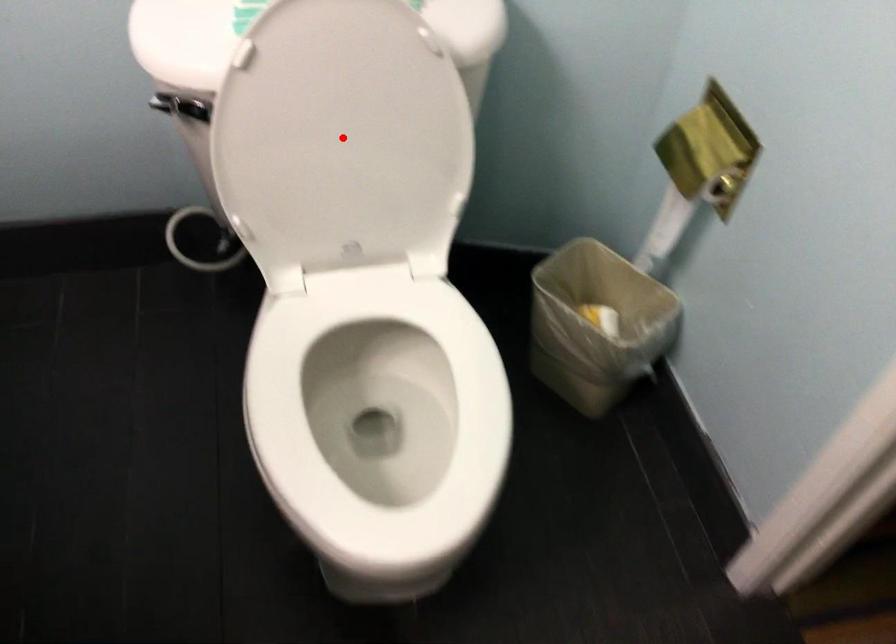
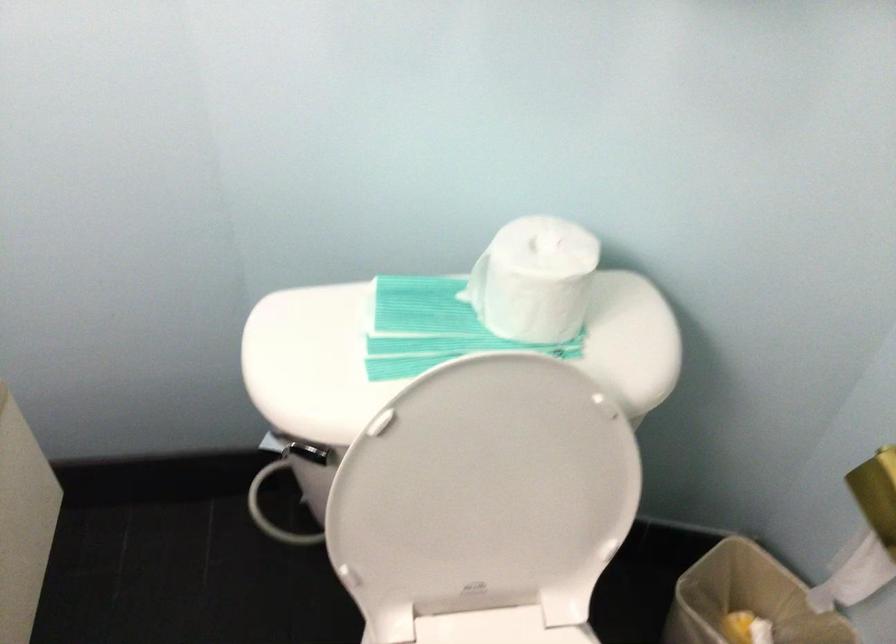
Question: I am providing you with two images of the same scene from different viewpoints. Image1 has a red point marked. In image2, the corresponding 3D location appears at what relative position? Reply with the corresponding letter.

Choices:
 (A) Closer
 (B) Farther

Answer: (A)